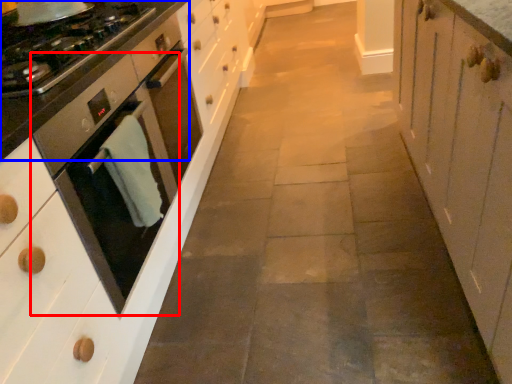
Question: Among these objects, which one is nearest to the camera, home appliance (highlighted by a red box) or countertop (highlighted by a blue box)?

Choices:
 (A) home appliance
 (B) countertop

Answer: (A)